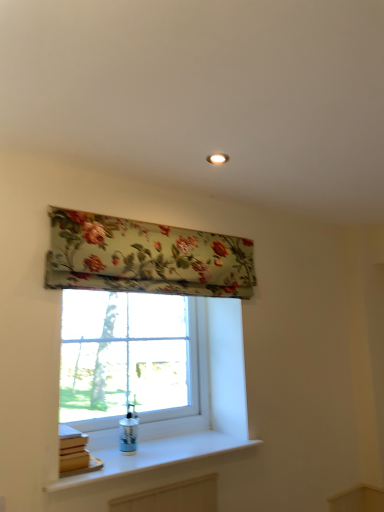
You are a GUI agent. You are given a task and a screenshot of the screen. Output one action in this format:
    pyautogui.click(x=<x>, y=<y>)
    Task: Click on the blank space situated above floral fabric window blind at upper center (from a real-world perspective)
    The image size is (384, 512).
    Given the screenshot: What is the action you would take?
    pyautogui.click(x=164, y=223)